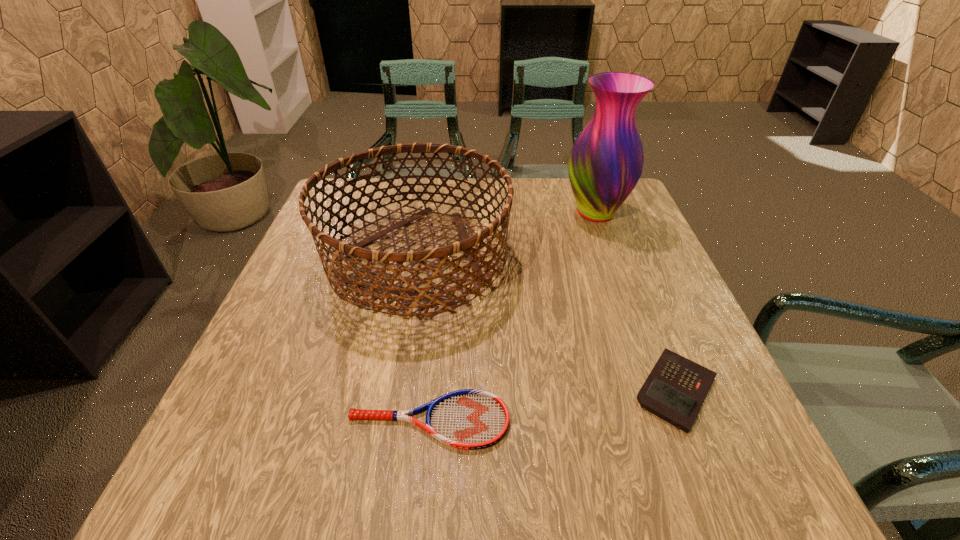
You are a GUI agent. You are given a task and a screenshot of the screen. Output one action in this format:
    pyautogui.click(x=<x>, y=<y>)
    Task: Click on the free space at the near left corner of the desktop
    This screenshot has width=960, height=540.
    Given the screenshot: What is the action you would take?
    pyautogui.click(x=227, y=507)

Locate an element on the screen. free space between the third tallest object and the shortest object is located at coordinates (553, 406).

This screenshot has width=960, height=540. Identify the location of free spot between the tennis racket and the second tallest object. (422, 340).

The width and height of the screenshot is (960, 540). In order to click on unoccupied area between the calculator and the shortest object in this screenshot , I will do `click(553, 406)`.

The height and width of the screenshot is (540, 960). What are the coordinates of `free space between the tallest object and the third tallest object` in the screenshot? It's located at (636, 302).

Where is `free area in between the second shortest object and the second tallest object`? free area in between the second shortest object and the second tallest object is located at coordinates [546, 325].

This screenshot has width=960, height=540. I want to click on free spot between the tennis racket and the calculator, so click(553, 406).

I want to click on vacant space in between the third shortest object and the shortest object, so click(x=422, y=340).

Locate an element on the screen. The image size is (960, 540). free space between the vase and the basket is located at coordinates (506, 236).

At what (x,y) coordinates should I click in order to perform the action: click on unoccupied area between the tallest object and the calculator. Please return your answer as a coordinate pair (x, y). This screenshot has height=540, width=960. Looking at the image, I should click on (636, 302).